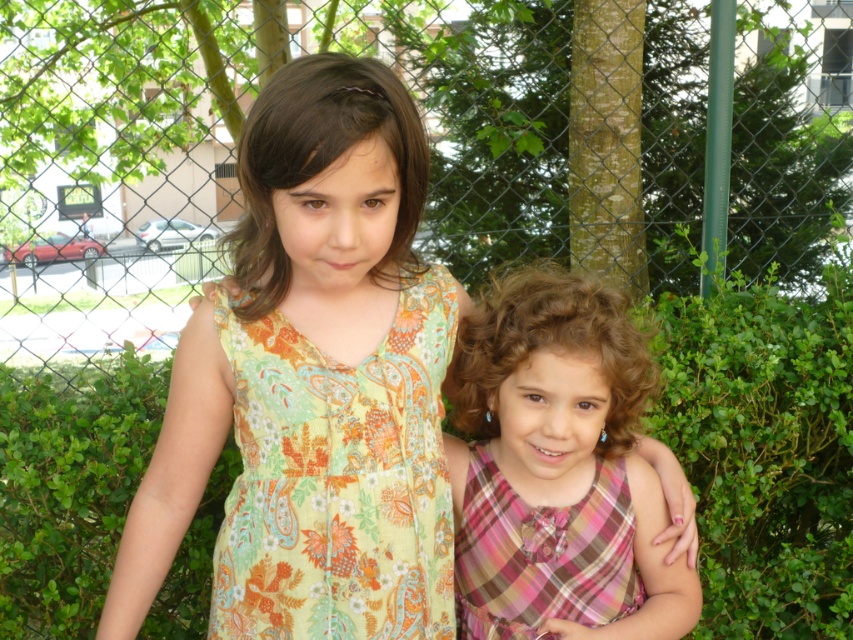
Question: Can you confirm if metallic chain-link fence at center is bigger than pink plaid dress at center?

Choices:
 (A) no
 (B) yes

Answer: (B)

Question: Does floral-patterned dress at center appear under floral-patterned fabric dress at center?

Choices:
 (A) no
 (B) yes

Answer: (A)

Question: Considering the real-world distances, which object is closest to the pink plaid dress at lower right?

Choices:
 (A) floral-patterned dress at center
 (B) floral-patterned fabric dress at center

Answer: (B)

Question: Is metallic chain-link fence at center further to camera compared to pink plaid dress at center?

Choices:
 (A) no
 (B) yes

Answer: (B)

Question: Which object appears farthest from the camera in this image?

Choices:
 (A) floral-patterned fabric dress at center
 (B) pink plaid dress at lower right

Answer: (B)

Question: Which of these objects is positioned farthest from the floral-patterned fabric dress at center?

Choices:
 (A) pink plaid dress at lower right
 (B) pink plaid dress at center
 (C) metallic chain-link fence at center
 (D) floral-patterned dress at center

Answer: (C)